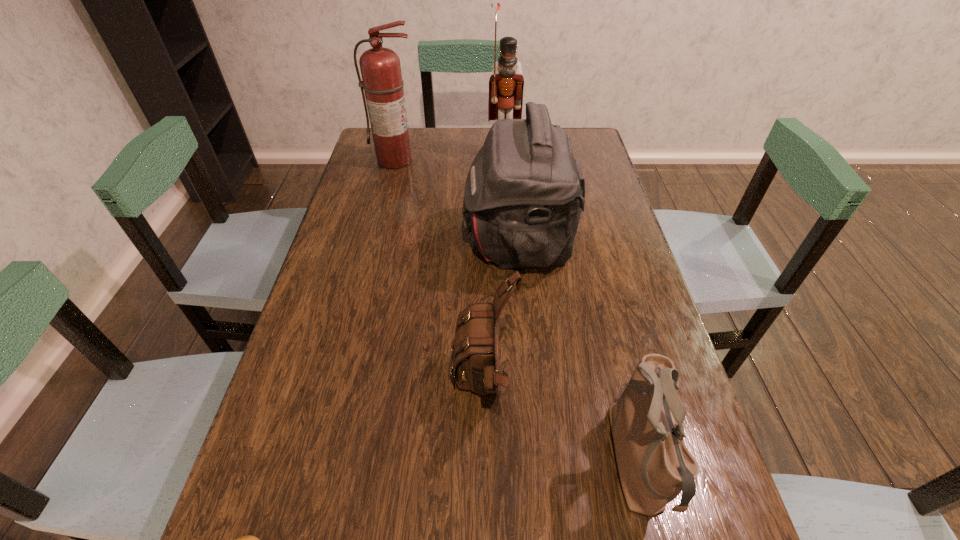
Where is `fire extinguisher that is at the far edge`? This screenshot has width=960, height=540. fire extinguisher that is at the far edge is located at coordinates (382, 82).

Where is `object situated at the left edge`? object situated at the left edge is located at coordinates (382, 82).

Identify the location of object positioned at the far left corner. (382, 82).

Where is `vacant space at the far edge`? This screenshot has width=960, height=540. vacant space at the far edge is located at coordinates (471, 146).

Identify the location of free spot at the left edge of the desktop. The width and height of the screenshot is (960, 540). (303, 443).

Locate an element on the screen. This screenshot has width=960, height=540. vacant space at the right edge is located at coordinates (598, 336).

This screenshot has height=540, width=960. In order to click on empty location between the nutcracker and the fire extinguisher in this screenshot , I will do `click(449, 158)`.

The image size is (960, 540). I want to click on vacant area that lies between the fire extinguisher and the nutcracker, so click(x=449, y=158).

Where is `object that is the closest one to the nutcracker`? The width and height of the screenshot is (960, 540). object that is the closest one to the nutcracker is located at coordinates (524, 192).

Find the location of a particular element. This screenshot has height=540, width=960. object that ranks as the second closest to the shortest object is located at coordinates (654, 464).